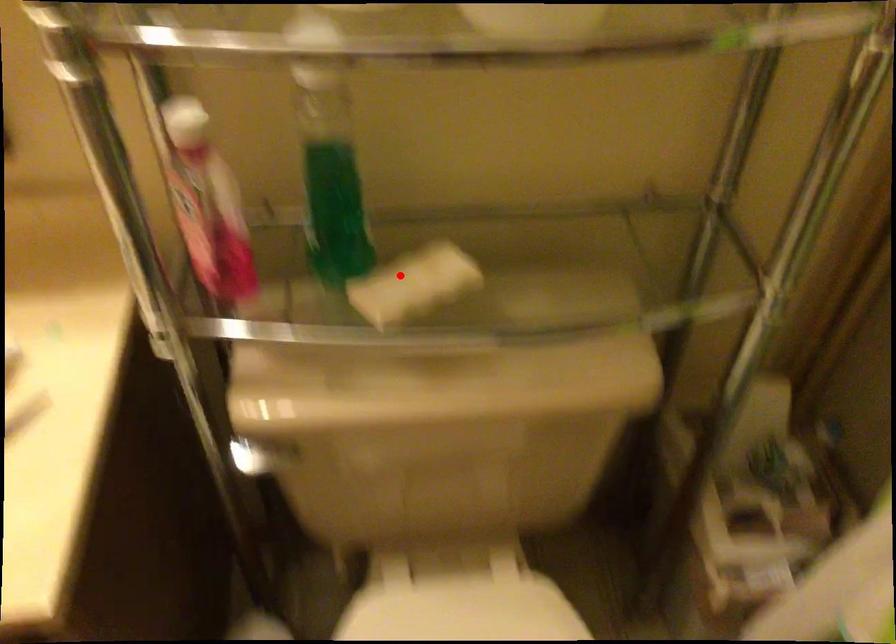
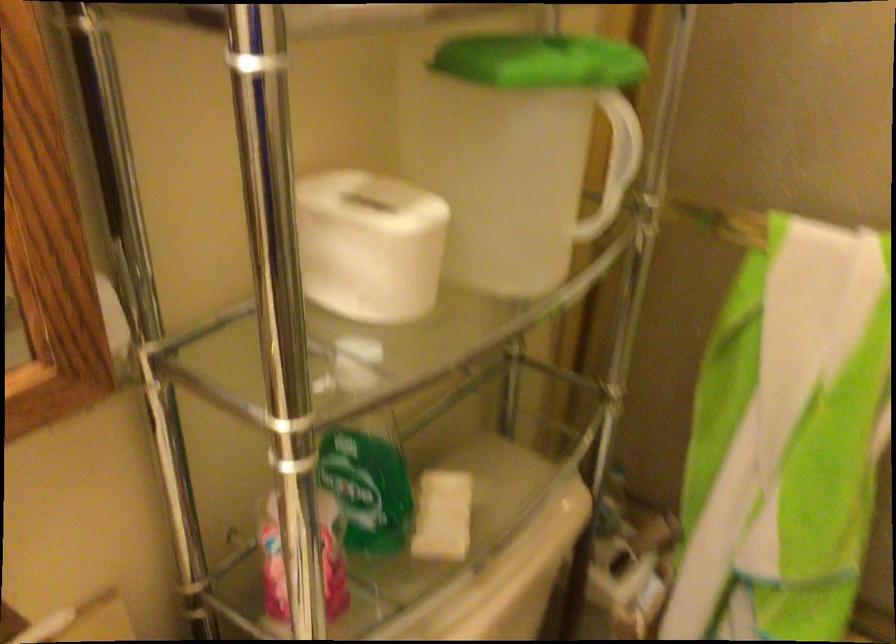
Question: I am providing you with two images of the same scene from different viewpoints. A red point is marked on the first image. Is the red point's position out of view in image 2?

Choices:
 (A) Yes
 (B) No

Answer: (B)